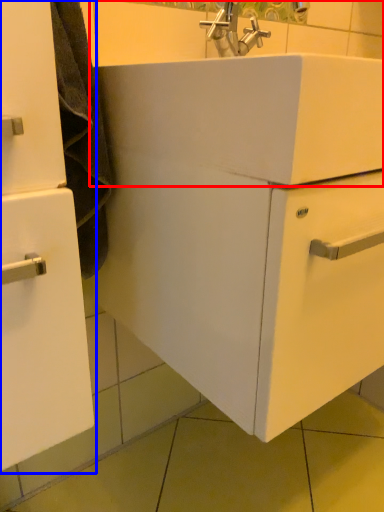
Question: Which of the following is the closest to the observer, sink (highlighted by a red box) or bathroom cabinet (highlighted by a blue box)?

Choices:
 (A) sink
 (B) bathroom cabinet

Answer: (A)